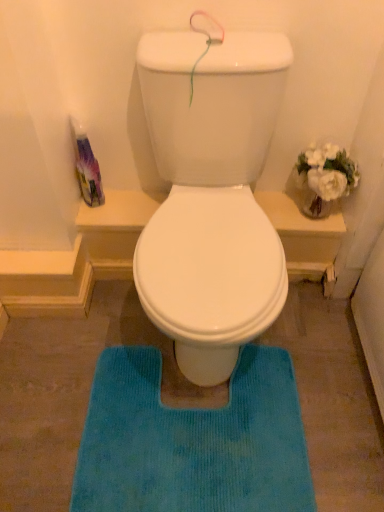
Find the location of a particular element. The image size is (384, 512). vacant location below blue textured bath mat at center (from a real-world perspective) is located at coordinates (175, 451).